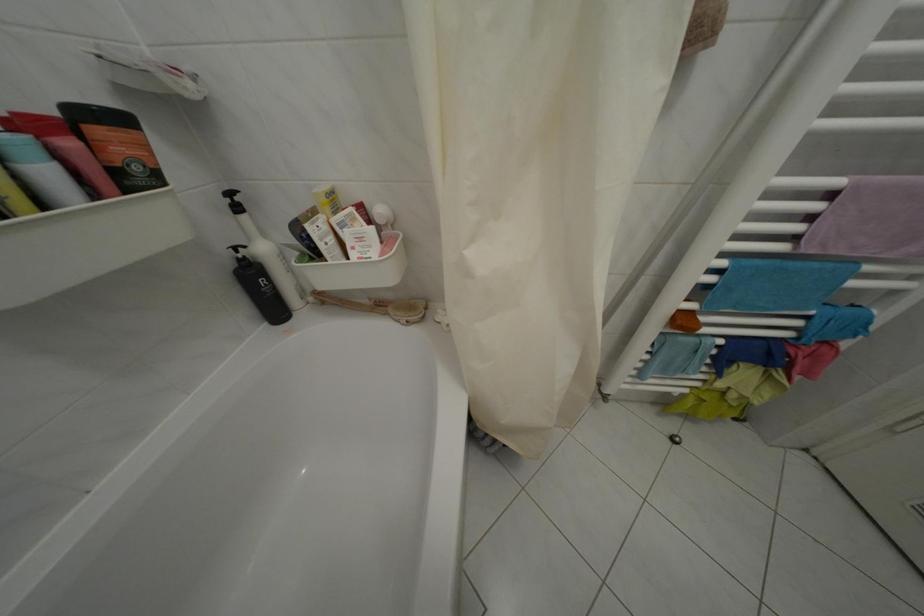
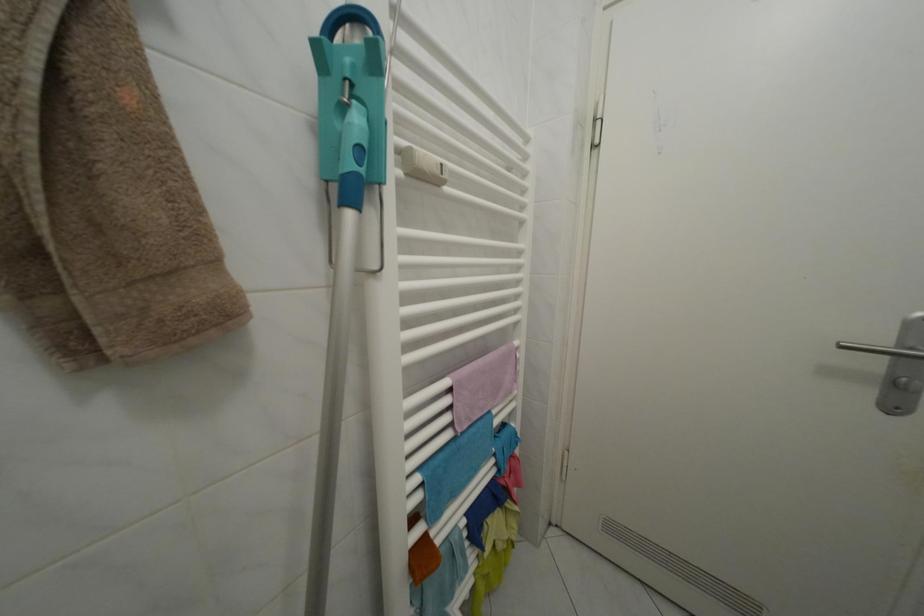
Find the pixel in the second image that matches point 732,270 in the first image.

(427, 485)